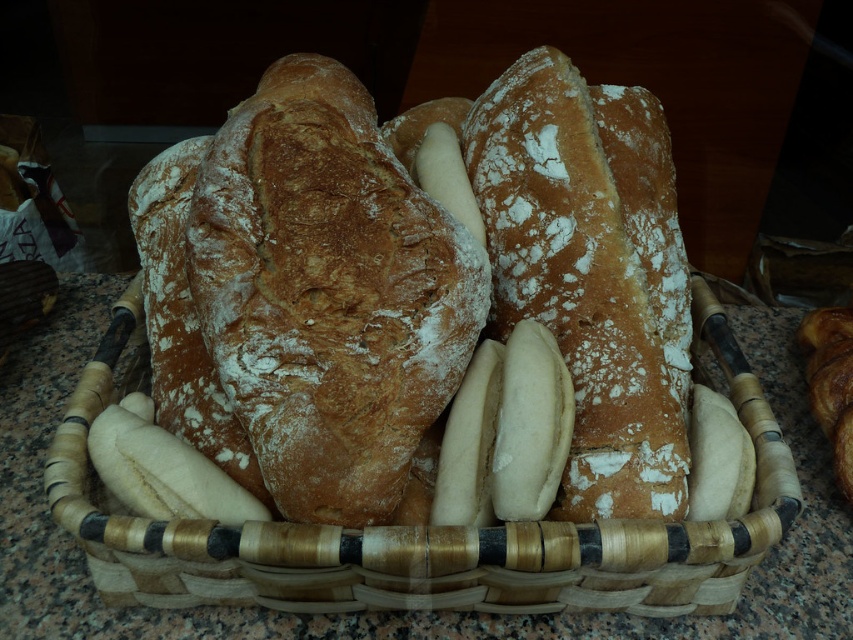
Based on the photo, you are a baker who needs to place a new loaf of bread into the basket without touching the existing bread. The new loaf is 30 centimeters long. Can you fit it between the golden crusty loaf at center and the brown woven basket at center?

The distance between the golden crusty loaf at center and the brown woven basket at center is 27.90 centimeters. Since the new loaf is 30 centimeters long, it cannot fit in the space between them as it is longer than the available space.

You are standing in front of a basket of bread on a kitchen counter. There are two points marked in the image, one at coordinates point (583, 371) and another at point (256, 540). If you were to reach into the basket to touch these points, which point would require your hand to go deeper into the basket?

Point (256, 540) would require your hand to go deeper into the basket because it is closer to the back of the basket compared to point (583, 371), which is closer to the front.

You are a baker who wants to place a new loaf of bread into the basket. The new loaf is the same size as the golden brown crusty loaf at center. Will it fit inside the brown woven basket at center?

The golden brown crusty loaf at center is much taller than the brown woven basket at center, so a new loaf of the same size would not fit inside the basket because it exceeds the basket height.